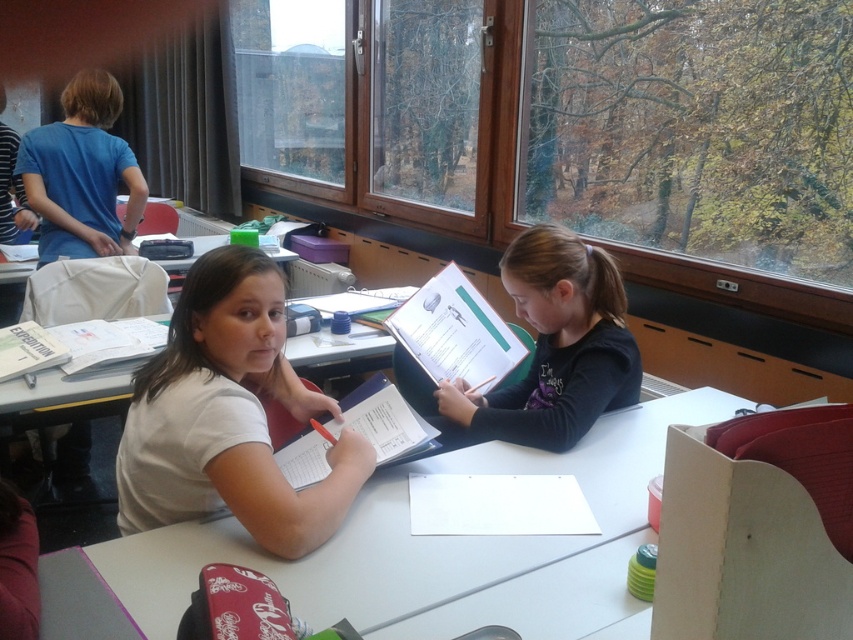
Question: Which object is positioned closest to the white matte shirt at center?

Choices:
 (A) matte black shirt at center
 (B) blue cotton shirt at upper left

Answer: (A)

Question: Does white plastic table at center appear over matte blue binder at center?

Choices:
 (A) no
 (B) yes

Answer: (A)

Question: In this image, where is blue cotton shirt at upper left located relative to matte blue binder at center?

Choices:
 (A) below
 (B) above

Answer: (B)

Question: Which object appears closest to the camera in this image?

Choices:
 (A) white matte shirt at center
 (B) blue cotton shirt at upper left
 (C) matte black shirt at center
 (D) white plastic table at center

Answer: (D)

Question: Based on their relative distances, which object is farther from the blue cotton shirt at upper left?

Choices:
 (A) white matte shirt at center
 (B) white plastic table at center
 (C) matte blue binder at center

Answer: (B)

Question: Is white matte shirt at center to the left of matte blue binder at center from the viewer's perspective?

Choices:
 (A) no
 (B) yes

Answer: (B)